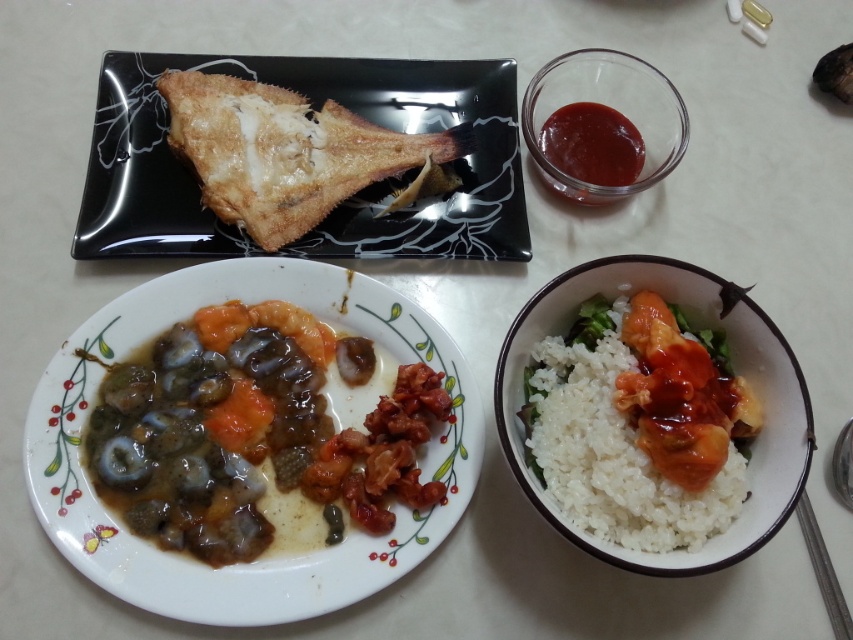
You are a guest at a dinner table and want to reach for the shiny brown seafood at center left and the translucent glass bowl at upper right. Which item is easier to grab without moving your chair?

The shiny brown seafood at center left is closer to the viewer than the translucent glass bowl at upper right, so it is easier to grab without moving your chair.